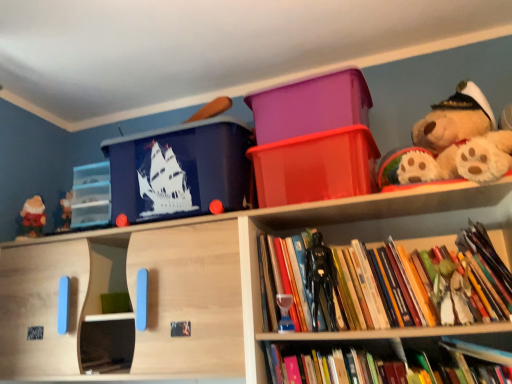
Question: Is black plastic action figure at center, the second toy positioned from the front, situated inside matte blue plastic storage box at upper left, marked as the 2th storage box in a left-to-right arrangement, or outside?

Choices:
 (A) inside
 (B) outside

Answer: (B)

Question: Considering the positions of black plastic action figure at center, which ranks as the second toy in right-to-left order, and matte blue plastic storage box at upper left, arranged as the 3th storage box when viewed from the right, in the image, is black plastic action figure at center, which ranks as the second toy in right-to-left order, bigger or smaller than matte blue plastic storage box at upper left, arranged as the 3th storage box when viewed from the right,?

Choices:
 (A) big
 (B) small

Answer: (B)

Question: Estimate the real-world distances between objects in this image. Which object is closer to the hardcover book at lower center, the first book positioned from the bottom?

Choices:
 (A) matte red santa at left, marked as the first toy in a left-to-right arrangement
 (B) hardcover books at center, the first book from the top
 (C) black plastic action figure at center, the third toy positioned from the back
 (D) translucent glass hourglass at center, which is the second toy from back to front
 (E) purple plastic bin at upper center, which is the 2th storage box in right-to-left order

Answer: (B)

Question: Considering the real-world distances, which object is closest to the transparent plastic drawers at left, which ranks as the 1th storage box in left-to-right order?

Choices:
 (A) fluffy beige teddy bear at upper right
 (B) hardcover book at lower center, the first book positioned from the bottom
 (C) translucent glass hourglass at center, placed as the 3th toy when sorted from front to back
 (D) shiny red plastic container at upper center, which is the 4th storage box from left to right
 (E) black plastic action figure at center, the third toy positioned from the back

Answer: (D)